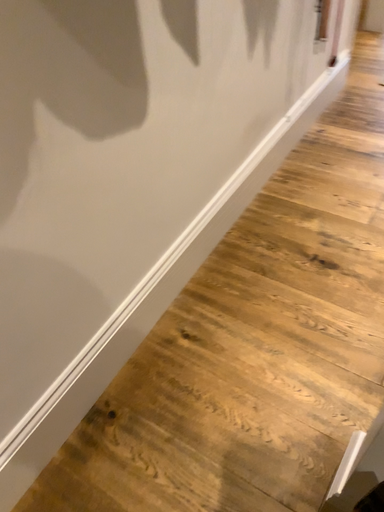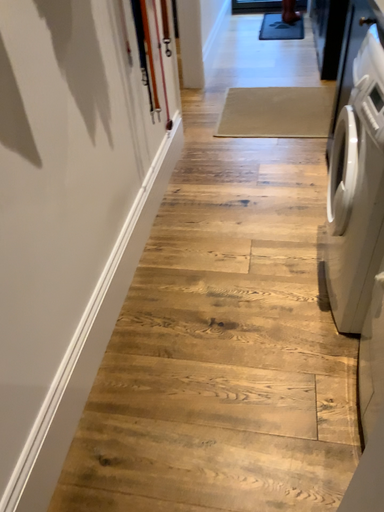
Question: How did the camera likely rotate when shooting the video?

Choices:
 (A) rotated downward
 (B) rotated upward

Answer: (B)